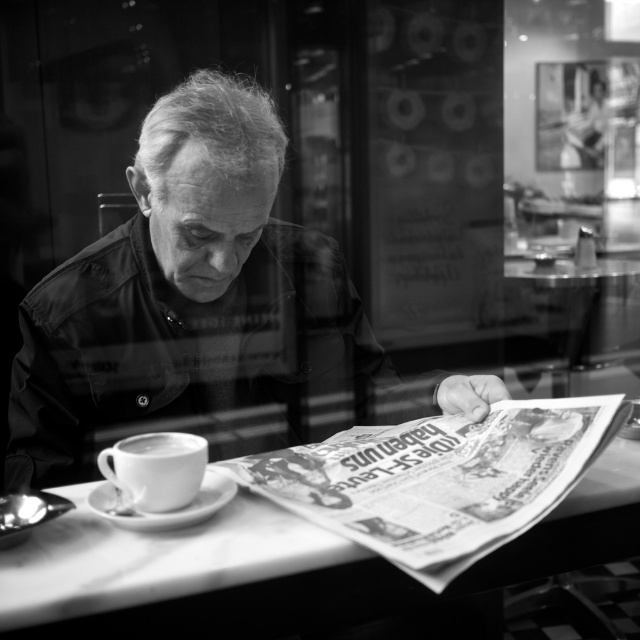
You are a photographer trying to capture a closeup of the smooth leather jacket at center. The camera you are using has a minimum focusing distance of 30 inches. Can you take the photo without moving the jacket?

The smooth leather jacket at center is 31.44 inches from the camera, which is beyond the minimum focusing distance of 30 inches. Therefore, you can take the photo without moving the jacket.

You are a waiter in a restaurant and need to place a new order of soup next to the white glossy cup at lower left without moving it. Where should you place the soup bowl relative to the white marble table at center?

The white marble table at center is to the right of the white glossy cup at lower left, so you should place the soup bowl to the left side of the white marble table at center to keep it next to the cup without moving it.